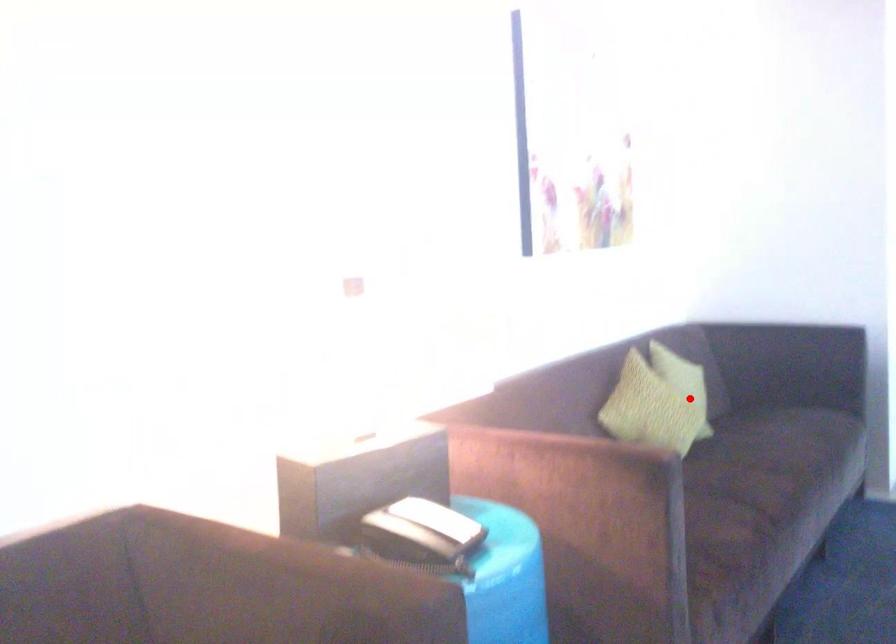
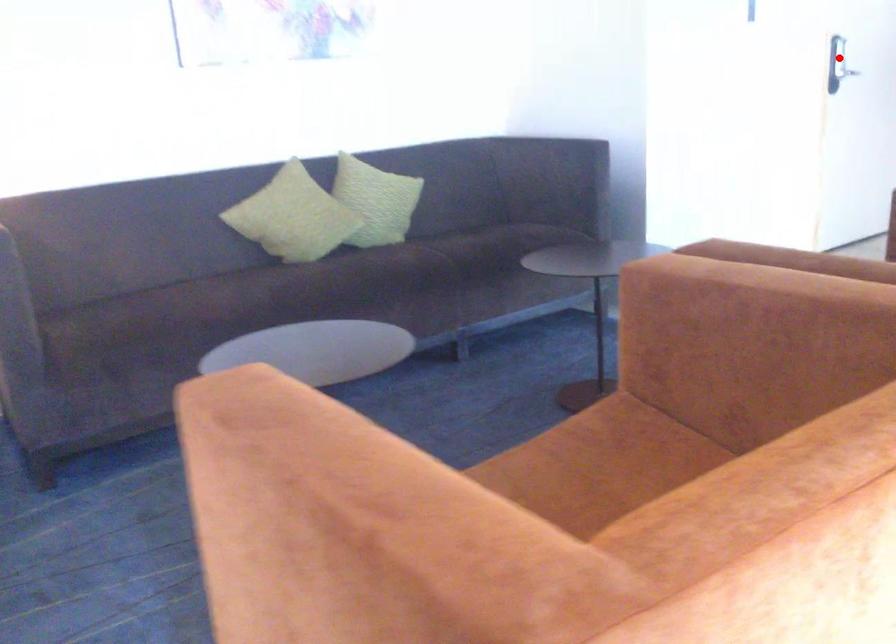
I am providing you with two images of the same scene from different viewpoints. A red point is marked on the first image and another point is marked on the second image. Does the point marked in image1 correspond to the same location as the one in image2?

No